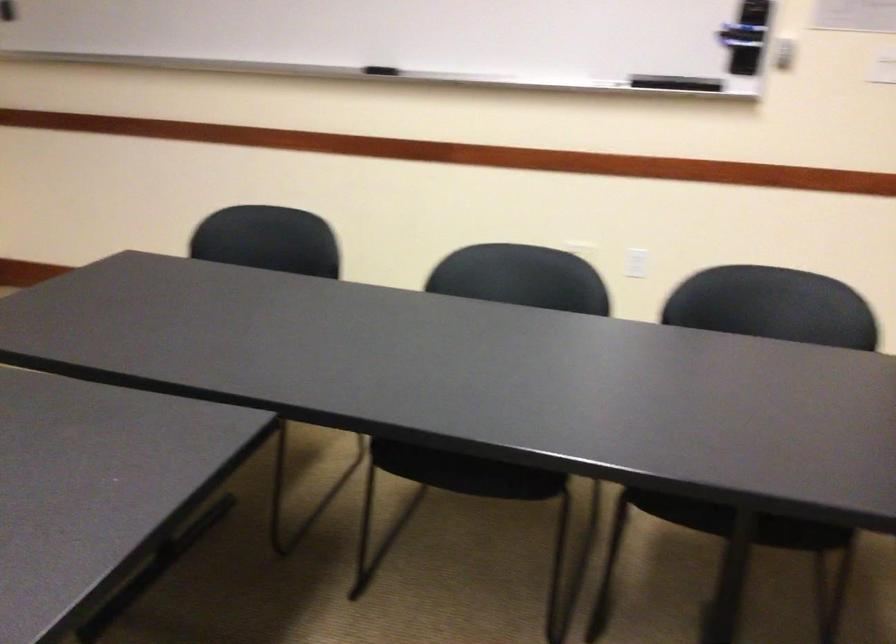
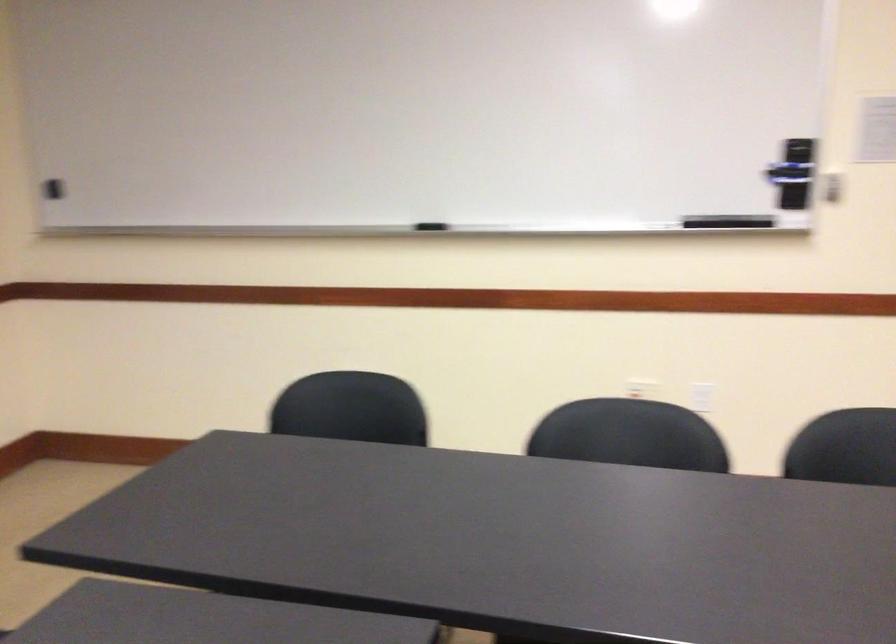
Question: How did the camera likely rotate?

Choices:
 (A) Left
 (B) Right
 (C) Up
 (D) Down

Answer: (C)